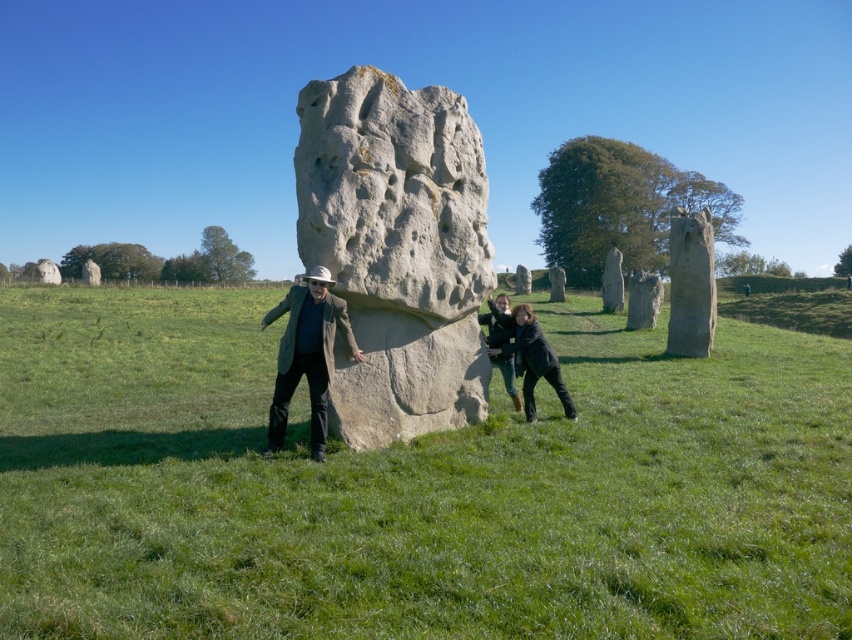
You are standing in the prehistoric stone circle and want to take a photo of the green grassy at center and the matte gray coat at center. Which object should you point your camera towards first if you want to capture both in a single frame without moving the camera?

You should point your camera towards the green grassy at center first because it is positioned on the left side of the matte gray coat at center, so capturing the left side first will include both objects in the frame.

You are a photographer planning to take a picture of the gray rough stone at center and the dark gray jacket at center. Since you want to emphasize the size difference between them, which object should you position closer to the camera to achieve this effect?

→ To emphasize the size difference between the gray rough stone at center and the dark gray jacket at center, you should position the dark gray jacket at center closer to the camera. Since the gray rough stone at center is larger in size, placing the smaller dark gray jacket at center nearer will create a visual contrast where both objects appear similar in size, thereby highlighting their actual size difference when viewed from this perspective.

You are a photographer standing at the edge of the stone circle. You want to take a photo of the green grassy at center and the matte gray coat at center. Which object appears taller in the photo?

The green grassy at center appears taller than the matte gray coat at center in the photo.